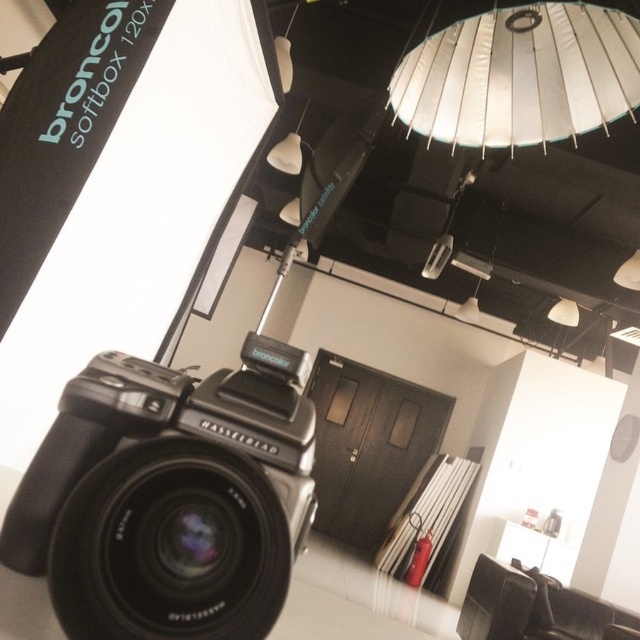
You are a photographer setting up a studio. You have a Hasselblad camera and a Broncolor softbox. The camera is at point (170, 497). The softbox is to the left of the camera. If you want to adjust the softbox to be directly in front of the camera, which direction should you move it?

The softbox is currently to the left of the black matte hasselblad camera at center. To position it directly in front, move it to the right towards the camera.

You are setting up a photography studio and need to choose between the white fabric lampshade at upper center and the white matte lampshade at upper center for a project requiring wider light coverage. Based on the scene description, which lampshade would you select and why?

The white fabric lampshade at upper center has a larger width than the white matte lampshade at upper center, so it would provide wider light coverage for the photography project.

You are standing in the photography studio and want to move from the camera to the ceiling lights. Which direction should you move relative to the two points labeled point (266, 376) and point (538, 10)?

To move from the camera to the ceiling lights, you should move away from point (266, 376) and towards point (538, 10) since point (266, 376) is in front of point (538, 10).